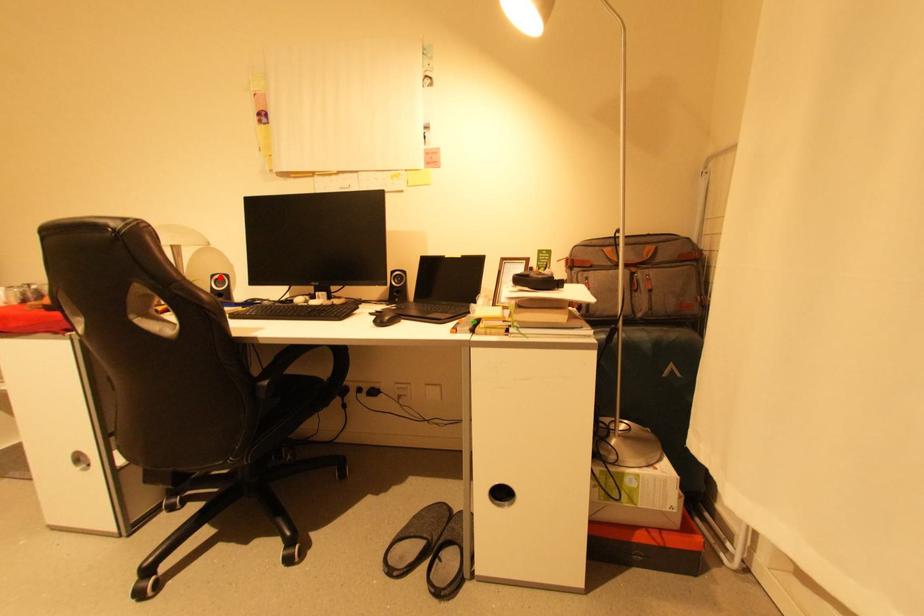
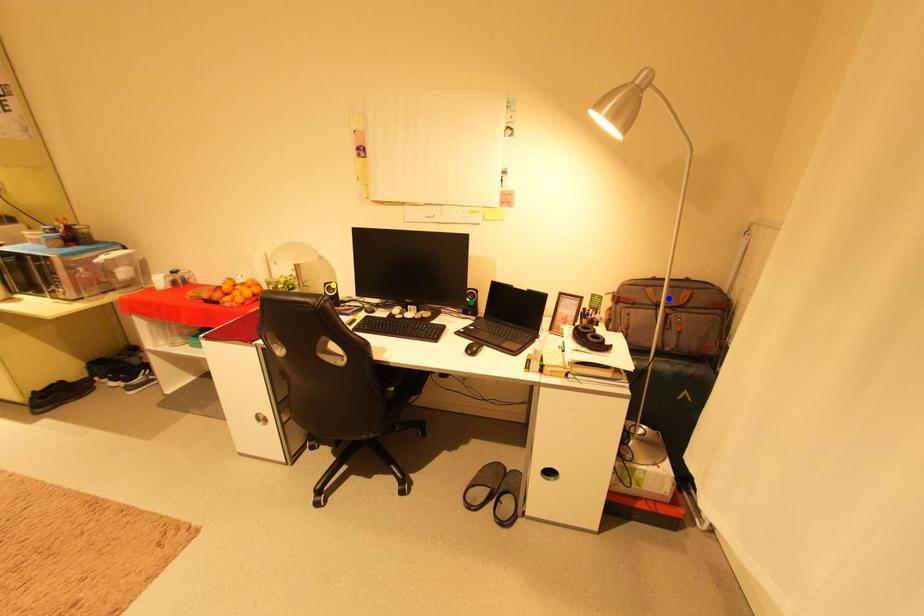
Question: I am providing you with two images of the same scene from different viewpoints. A red point is marked on the first image. You are given multiple points on the second image. Which point in image 2 represents the same 3d spot as the red point in image 1?

Choices:
 (A) blue point
 (B) yellow point
 (C) green point

Answer: (B)